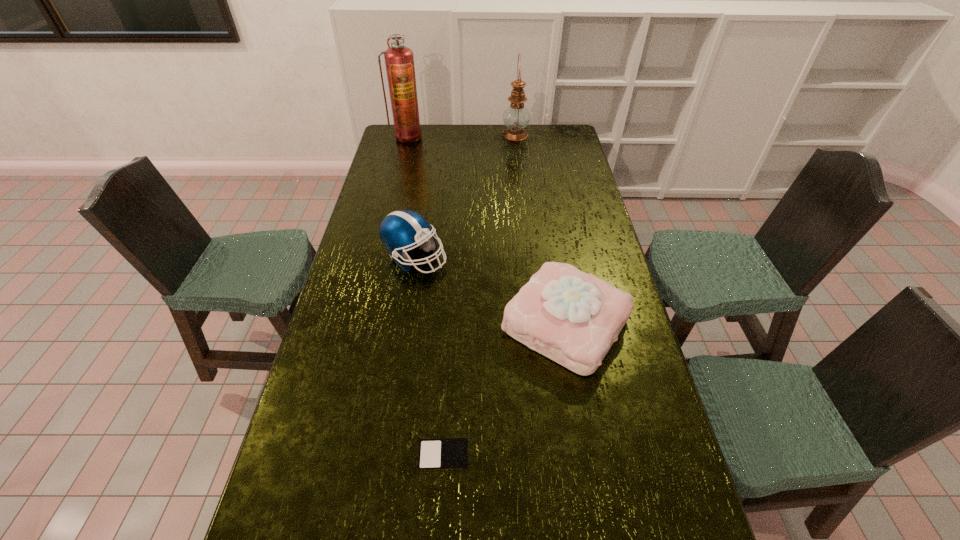
In the image, there is a desktop. At what (x,y) coordinates should I click in order to perform the action: click on vacant space at the far right corner. Please return your answer as a coordinate pair (x, y). Looking at the image, I should click on (549, 127).

This screenshot has width=960, height=540. I want to click on free space between the fire extinguisher and the iPod, so click(x=425, y=296).

Where is `unoccupied area between the fourth tallest object and the nearest object`? The height and width of the screenshot is (540, 960). unoccupied area between the fourth tallest object and the nearest object is located at coordinates (505, 390).

Find the location of `free space between the football helmet and the nearest object`. free space between the football helmet and the nearest object is located at coordinates (429, 356).

Identify the location of vacant area that lies between the fire extinguisher and the iPod. (425, 296).

You are a GUI agent. You are given a task and a screenshot of the screen. Output one action in this format:
    pyautogui.click(x=<x>, y=<y>)
    Task: Click on the vacant area that lies between the cake and the fire extinguisher
    The width and height of the screenshot is (960, 540).
    Given the screenshot: What is the action you would take?
    pyautogui.click(x=487, y=231)

Find the location of a particular element. The width and height of the screenshot is (960, 540). free space between the nearest object and the second shortest object is located at coordinates (505, 390).

In order to click on vacant space that's between the fire extinguisher and the cake in this screenshot , I will do `click(487, 231)`.

Where is `the closest object to the cake`? Image resolution: width=960 pixels, height=540 pixels. the closest object to the cake is located at coordinates (400, 230).

Identify which object is the fourth closest to the third shortest object. Please provide its 2D coordinates. Your answer should be formatted as a tuple, i.e. [(x, y)], where the tuple contains the x and y coordinates of a point satisfying the conditions above.

[(516, 117)]